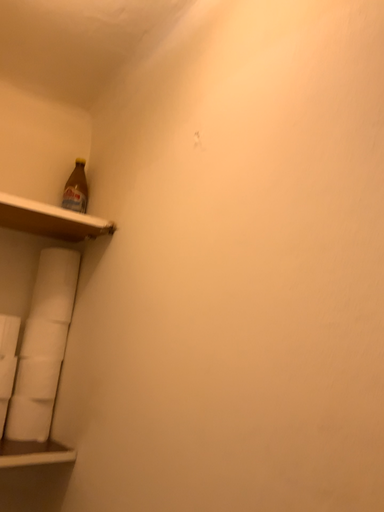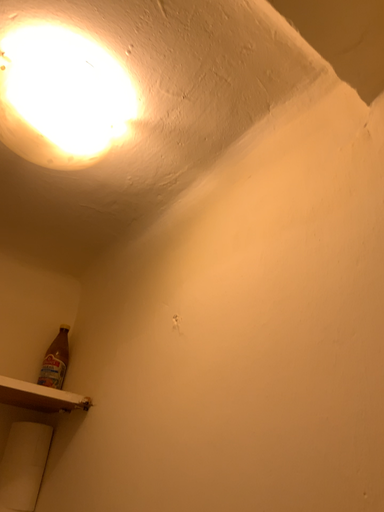
Question: How did the camera likely rotate when shooting the video?

Choices:
 (A) rotated upward
 (B) rotated downward

Answer: (A)